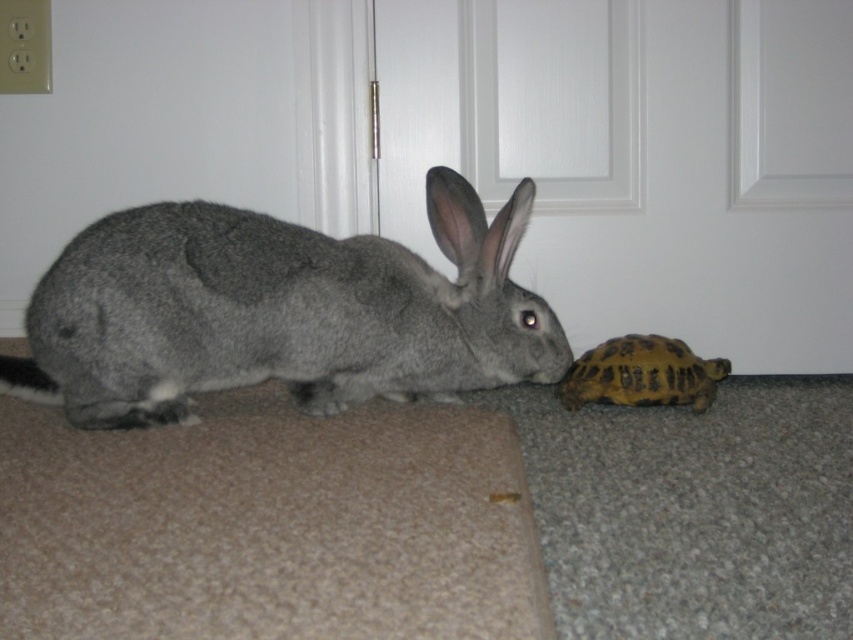
You are a small toy that is 10 cm tall. You want to hide under the gray fur rabbit at left so that the yellow scaly tortoise at lower right cannot see you. Is this possible based on the scene?

The gray fur rabbit at left has a greater height compared to yellow scaly tortoise at lower right. Since the rabbit is taller than the tortoise, the toy can hide under the rabbit and remain hidden from the tortoise.

You are a robotic pet sitter and need to place a small treat between the gray fur rabbit at left and the tortoise. According to their positions, where should you place the treat so that it is exactly halfway between them?

The gray fur rabbit at left is located at point (x=279, y=310). To place the treat exactly halfway between them, calculate the midpoint between the rabbit and the tortoise. However, since the tortoise coordinates aren not provided, the exact position can be determined if the tortoise coordinates are known.

Consider the image. You are a pet sitter who needs to separate the gray fur rabbit at left and the yellow scaly tortoise at lower right. Which direction should you move the tortoise to ensure it is no longer under the rabbit?

The gray fur rabbit at left is positioned over the yellow scaly tortoise at lower right. To ensure the tortoise is no longer under the rabbit, move it away from the rabbit in any direction except upward since the tortoise is lower than the rabbit.